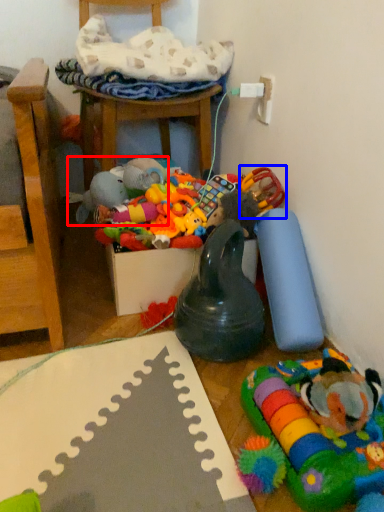
Question: Which object is further to the camera taking this photo, toy (highlighted by a red box) or toy (highlighted by a blue box)?

Choices:
 (A) toy
 (B) toy

Answer: (A)